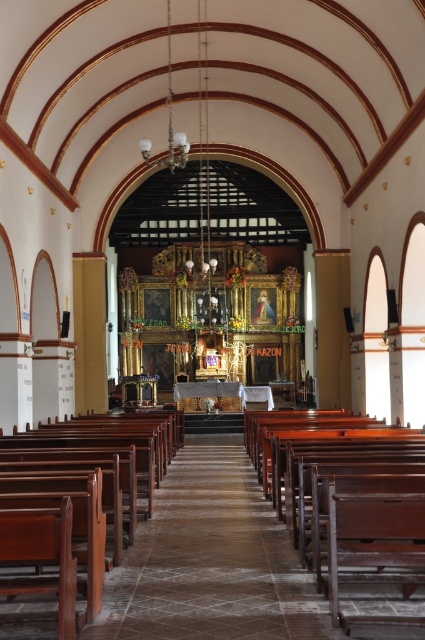
Question: Can you confirm if mahogany wood church bench at center is thinner than brown polished wood church bench at center?

Choices:
 (A) no
 (B) yes

Answer: (A)

Question: Among these objects, which one is farthest from the camera?

Choices:
 (A) mahogany wood church bench at center
 (B) brown polished wood church bench at center

Answer: (A)

Question: Does mahogany wood church bench at center appear on the right side of brown polished wood church bench at center?

Choices:
 (A) no
 (B) yes

Answer: (B)

Question: Among these points, which one is farthest from the camera?

Choices:
 (A) (357, 417)
 (B) (45, 467)

Answer: (A)

Question: Is mahogany wood church bench at center positioned behind brown polished wood church bench at center?

Choices:
 (A) yes
 (B) no

Answer: (A)